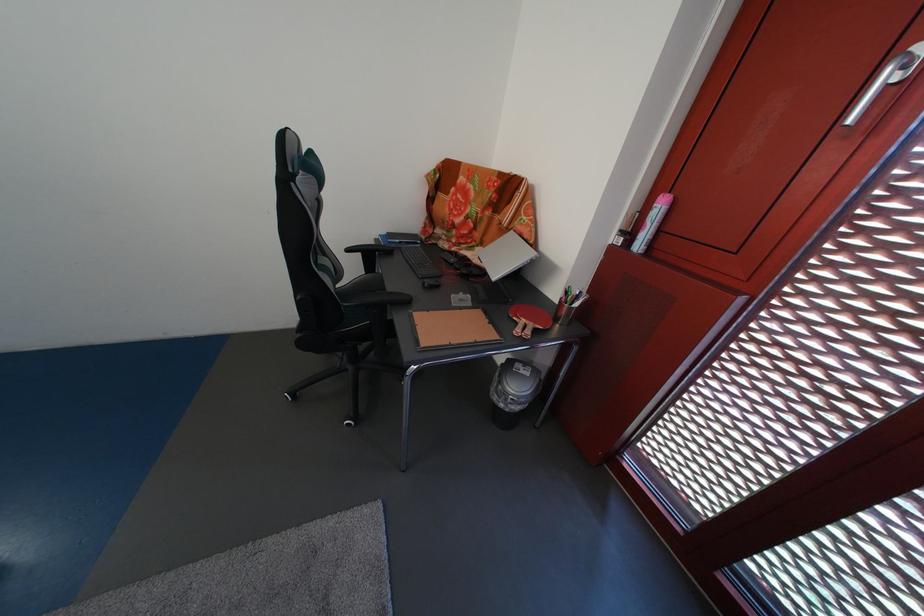
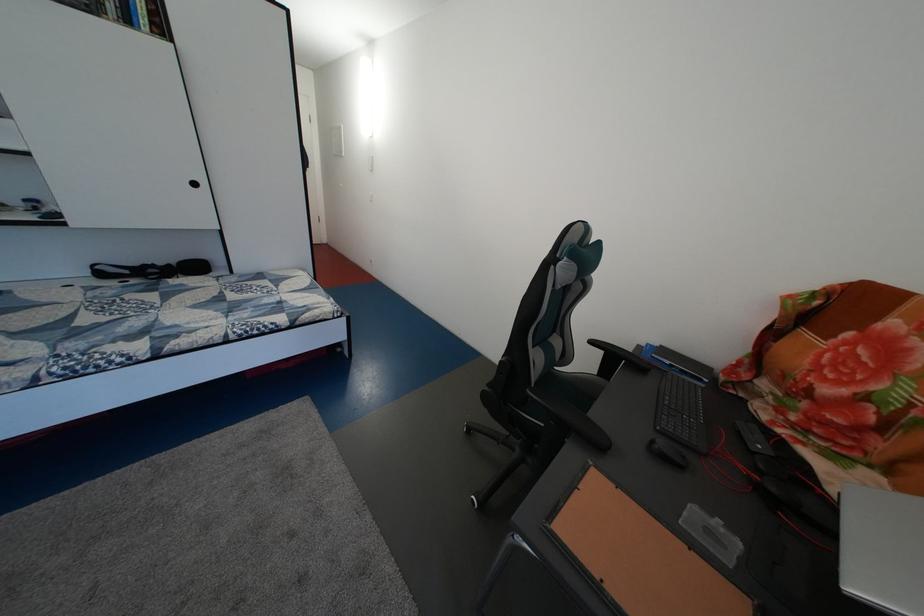
Question: The camera is either moving clockwise (left) or counter-clockwise (right) around the object. The first image is from the beginning of the video and the second image is from the end. Is the camera moving left or right when shooting the video?

Choices:
 (A) Left
 (B) Right

Answer: (B)